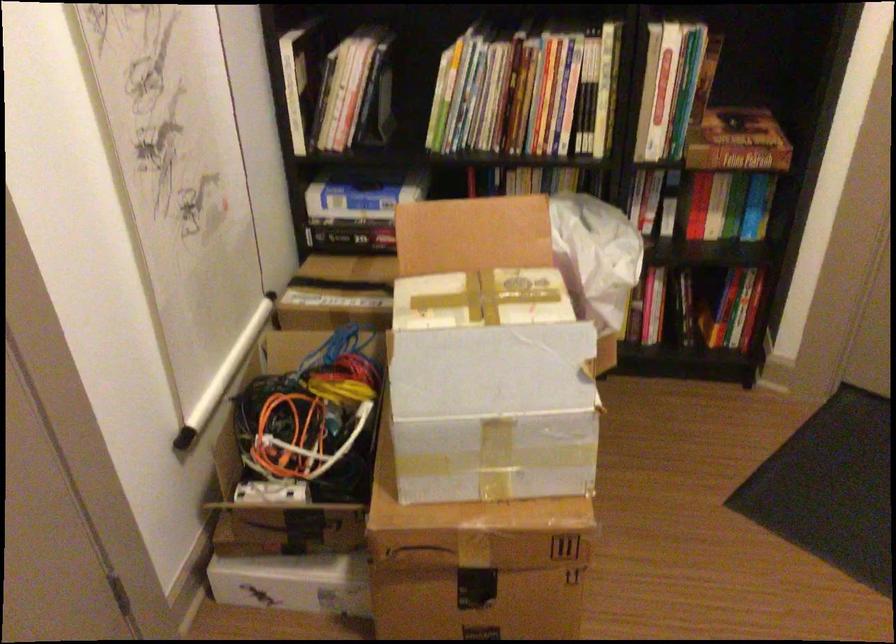
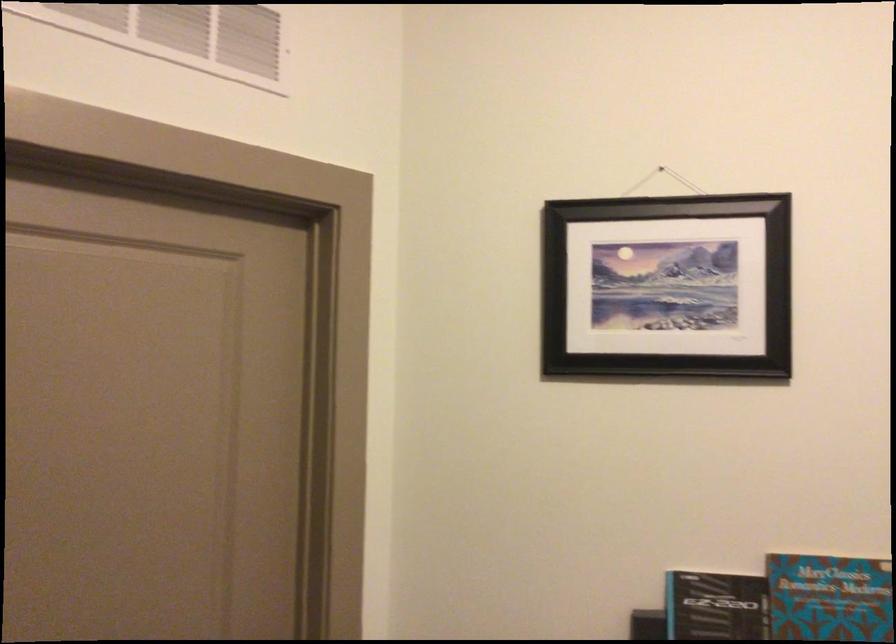
Question: The camera is either moving clockwise (left) or counter-clockwise (right) around the object. The first image is from the beginning of the video and the second image is from the end. Is the camera moving left or right when shooting the video?

Choices:
 (A) Left
 (B) Right

Answer: (A)